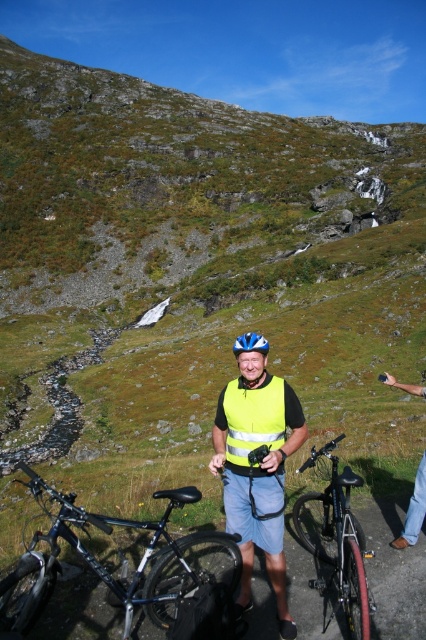
Question: Does yellow reflective vest at center appear on the left side of blue glossy bicycle helmet at center?

Choices:
 (A) no
 (B) yes

Answer: (B)

Question: Which of the following is the closest to the observer?

Choices:
 (A) (196, 637)
 (B) (236, 525)
 (C) (238, 340)
 (D) (365, 580)

Answer: (D)

Question: Does yellow reflective safety vest at center lie behind blue matte helmet at center?

Choices:
 (A) yes
 (B) no

Answer: (B)

Question: Which object is farther from the camera taking this photo?

Choices:
 (A) blue matte helmet at center
 (B) shiny black bike at center
 (C) blue glossy bicycle helmet at center

Answer: (C)

Question: Does yellow reflective vest at center have a larger size compared to shiny black bike at center?

Choices:
 (A) yes
 (B) no

Answer: (B)

Question: Which of the following is the farthest from the observer?

Choices:
 (A) shiny black bike at center
 (B) yellow reflective safety vest at center
 (C) shiny black bicycle at lower left

Answer: (B)